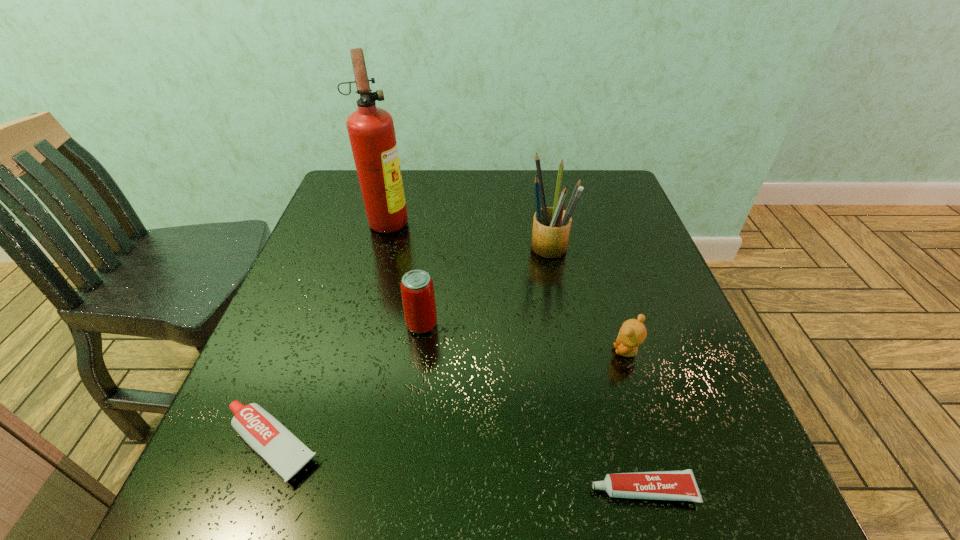
Find the location of a particular element. object present at the far edge is located at coordinates (371, 131).

Find the location of a particular element. fire extinguisher that is at the left edge is located at coordinates (371, 131).

Identify the location of toothpaste situated at the left edge. This screenshot has height=540, width=960. (285, 453).

Where is `teddy bear positioned at the right edge`? The image size is (960, 540). teddy bear positioned at the right edge is located at coordinates (633, 332).

Find the location of `toothpaste that is at the right edge`. toothpaste that is at the right edge is located at coordinates (680, 485).

At what (x,y) coordinates should I click in order to perform the action: click on object present at the far left corner. Please return your answer as a coordinate pair (x, y). The image size is (960, 540). Looking at the image, I should click on (371, 131).

Locate an element on the screen. object situated at the near left corner is located at coordinates (285, 453).

What are the coordinates of `object located in the near right corner section of the desktop` in the screenshot? It's located at [x=680, y=485].

Image resolution: width=960 pixels, height=540 pixels. In the image, there is a desktop. In order to click on vacant space at the far edge in this screenshot , I will do `click(527, 199)`.

The image size is (960, 540). Find the location of `free location at the near edge of the desktop`. free location at the near edge of the desktop is located at coordinates (570, 516).